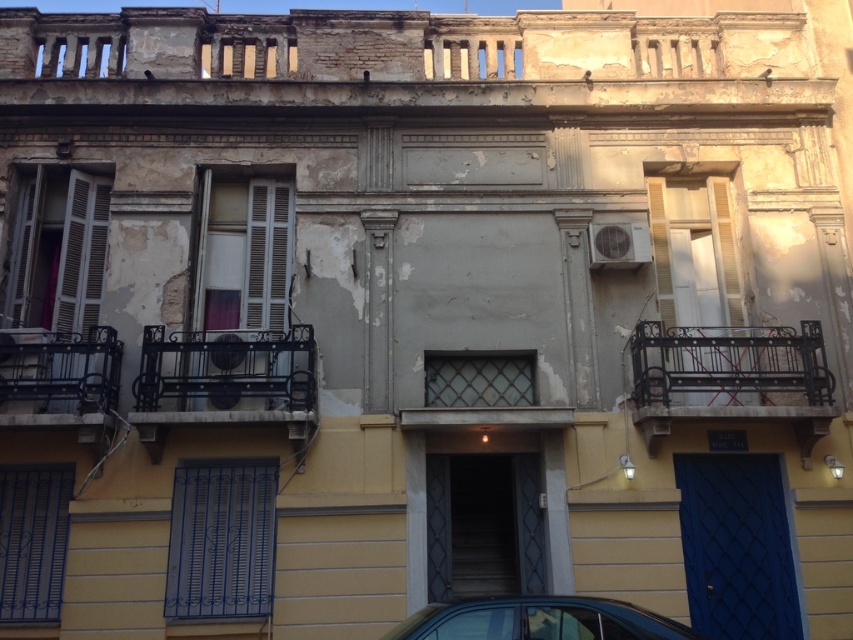
Question: Which point appears farthest from the camera in this image?

Choices:
 (A) (73, 483)
 (B) (106, 412)
 (C) (676, 314)

Answer: (C)

Question: Which point is closer to the camera?

Choices:
 (A) black wrought iron balcony at right
 (B) black wrought iron balcony at center

Answer: (B)

Question: Considering the relative positions of black wrought iron balcony at center and black wrought iron balcony at left in the image provided, where is black wrought iron balcony at center located with respect to black wrought iron balcony at left?

Choices:
 (A) right
 (B) left

Answer: (A)

Question: Estimate the real-world distances between objects in this image. Which object is farther from the metallic blue car at lower center?

Choices:
 (A) black wrought iron balcony at left
 (B) blue metallic shutter at left
 (C) white wooden shutter at center

Answer: (C)

Question: Considering the relative positions of black wrought iron balcony at left and blue metallic shutter at left in the image provided, where is black wrought iron balcony at left located with respect to blue metallic shutter at left?

Choices:
 (A) below
 (B) above

Answer: (B)

Question: Is matte gray shutters at left to the right of blue metallic shutter at left from the viewer's perspective?

Choices:
 (A) yes
 (B) no

Answer: (B)